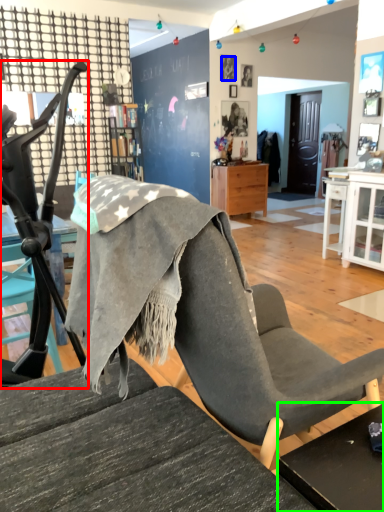
Question: Based on their relative distances, which object is farther from chair (highlighted by a red box)? Choose from person (highlighted by a blue box) and table (highlighted by a green box).

Choices:
 (A) person
 (B) table

Answer: (A)